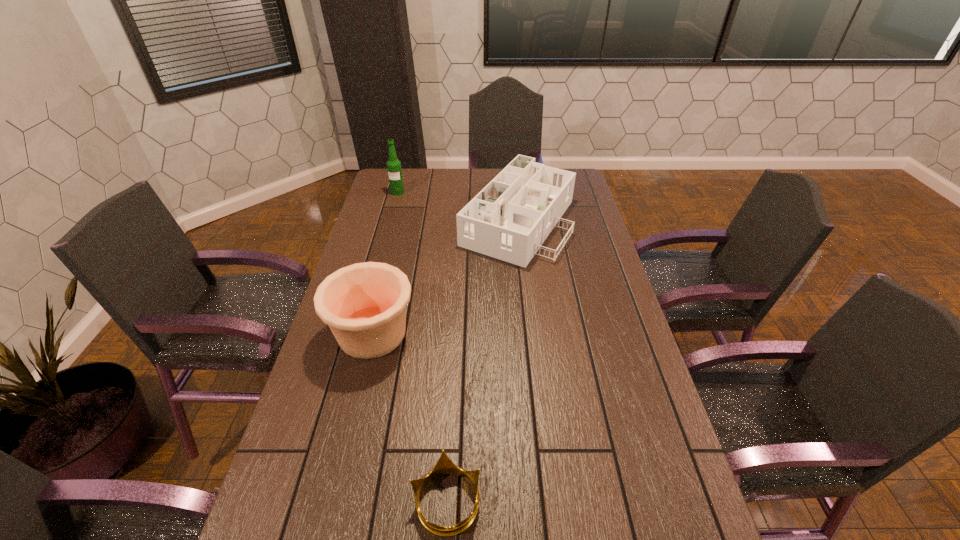
Where is `the tallest object`? This screenshot has width=960, height=540. the tallest object is located at coordinates (394, 169).

Where is `the third farthest object`? The image size is (960, 540). the third farthest object is located at coordinates (364, 304).

Locate an element on the screen. pottery is located at coordinates pyautogui.click(x=364, y=304).

Find the location of a particular element. The width and height of the screenshot is (960, 540). dollhouse is located at coordinates (509, 219).

You are a GUI agent. You are given a task and a screenshot of the screen. Output one action in this format:
    pyautogui.click(x=<x>, y=<y>)
    Task: Click on the shortest object
    The width and height of the screenshot is (960, 540).
    Given the screenshot: What is the action you would take?
    pyautogui.click(x=444, y=466)

Identify the location of the nearest object. The height and width of the screenshot is (540, 960). (444, 466).

Identify the location of vacant point located 0.100m on the label of the tallest object. The height and width of the screenshot is (540, 960). (394, 208).

Identify the location of free spot located 0.130m on the front of the pottery. The image size is (960, 540). (353, 411).

Locate an element on the screen. Image resolution: width=960 pixels, height=540 pixels. free space located 0.150m on the left of the dollhouse is located at coordinates (421, 220).

I want to click on free space located 0.230m on the left of the shortest object, so click(x=304, y=501).